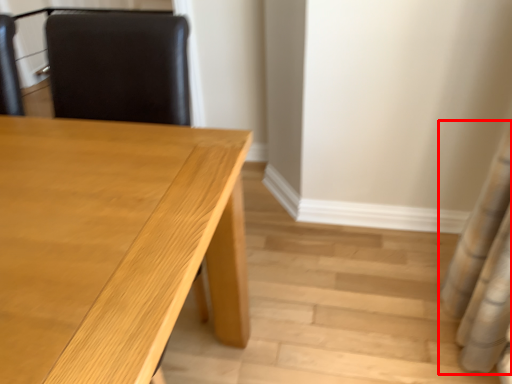
Question: From the image's perspective, what is the correct spatial relationship of shower curtain (annotated by the red box) in relation to table?

Choices:
 (A) below
 (B) above

Answer: (B)